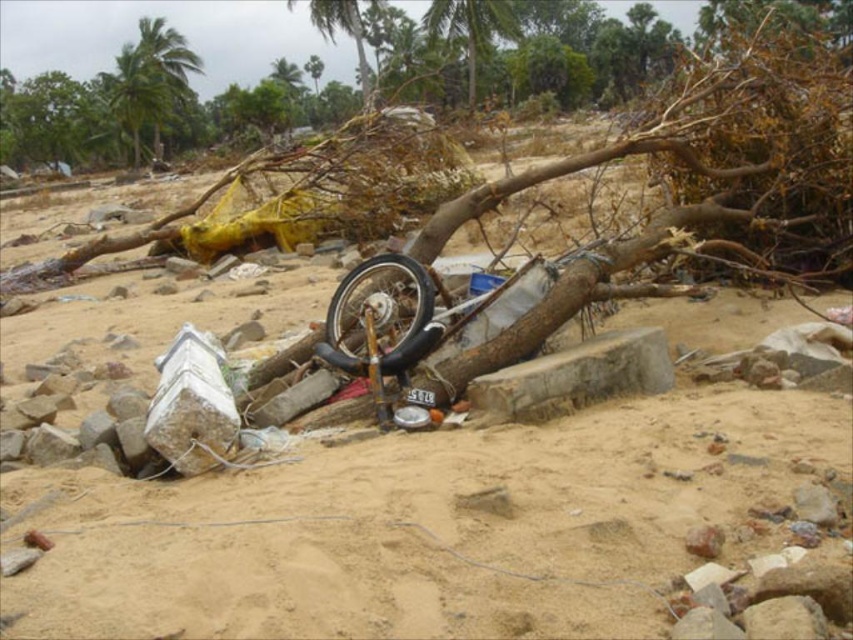
Question: Which object is farther from the camera taking this photo?

Choices:
 (A) black rubber wheel at center
 (B) green leafy palm tree at upper center

Answer: (B)

Question: Does green leafy palm tree at upper left appear on the right side of green leafy palm tree at upper center?

Choices:
 (A) yes
 (B) no

Answer: (B)

Question: Which of the following is the farthest from the observer?

Choices:
 (A) (140, 129)
 (B) (433, 22)
 (C) (403, 260)

Answer: (A)

Question: Is green leafy palm tree at upper left behind green leafy palm tree at upper center?

Choices:
 (A) no
 (B) yes

Answer: (B)

Question: Estimate the real-world distances between objects in this image. Which object is farther from the green leafy palm tree at upper center?

Choices:
 (A) black rubber wheel at center
 (B) green leafy palm tree at upper left

Answer: (A)

Question: Can you confirm if green leafy palm tree at upper left is bigger than green leafy palm tree at upper center?

Choices:
 (A) no
 (B) yes

Answer: (B)